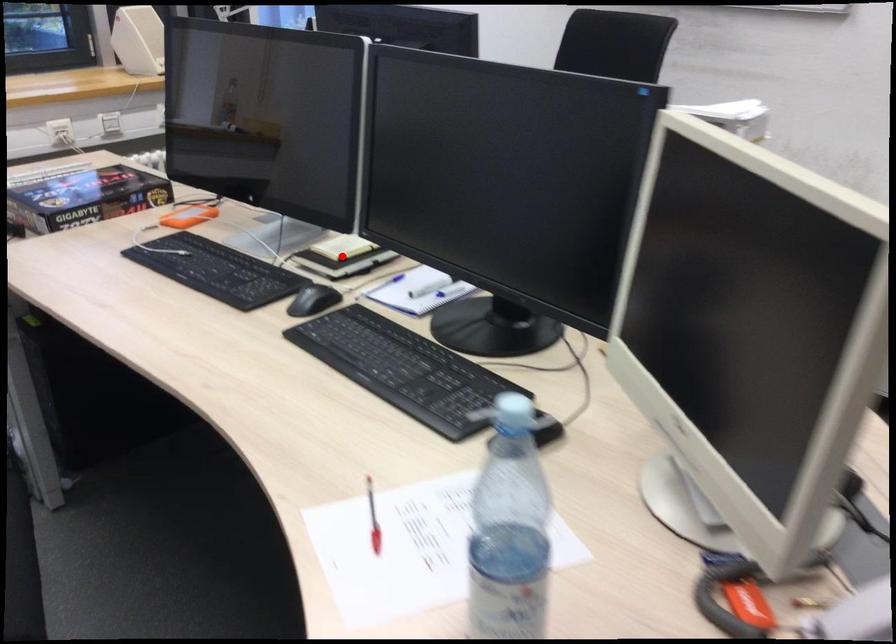
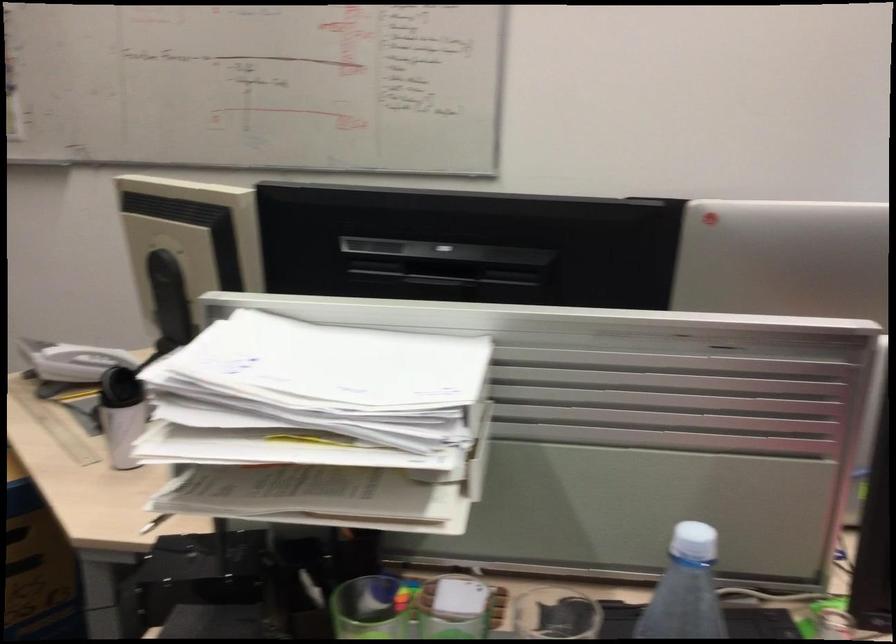
Question: I am providing you with two images of the same scene from different viewpoints. A red point is marked on the first image. At the location where the point appears in image 1, is it still visible in image 2?

Choices:
 (A) Yes
 (B) No

Answer: (B)